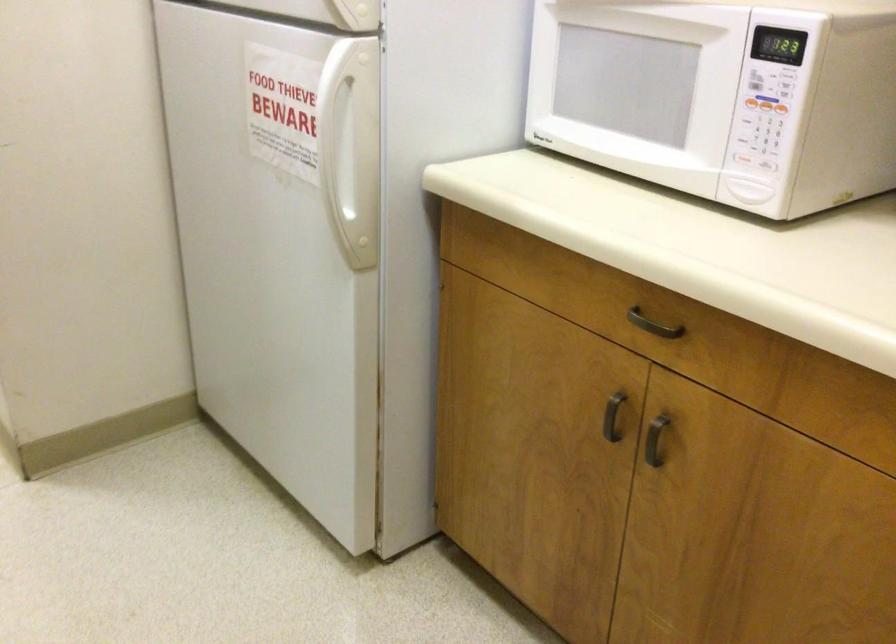
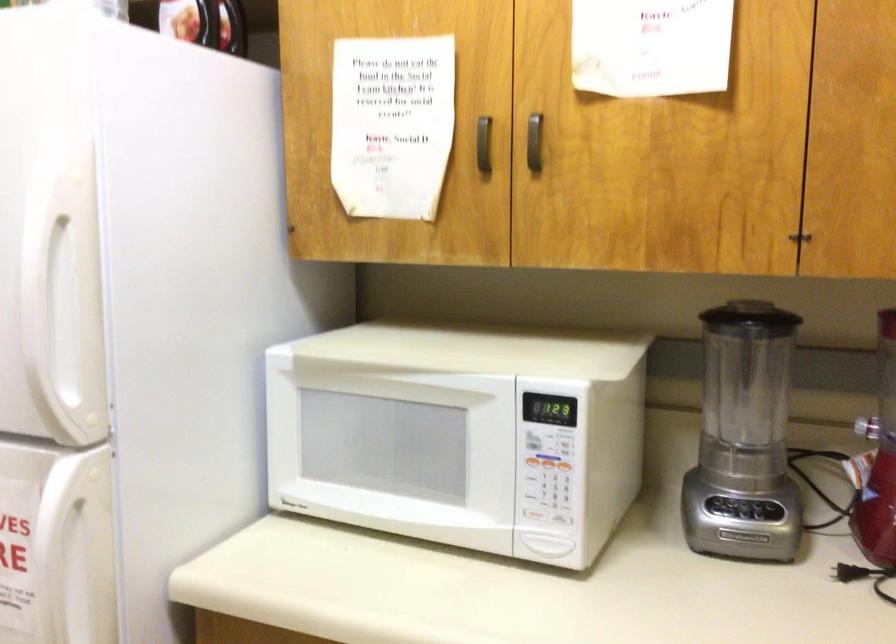
Where in the second image is the point corresponding to (x=764, y=160) from the first image?

(563, 518)